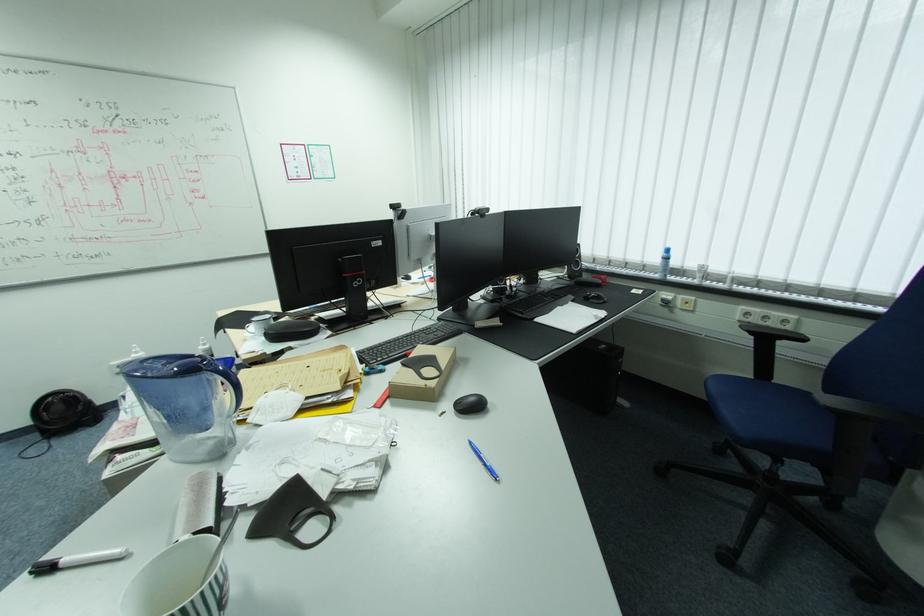
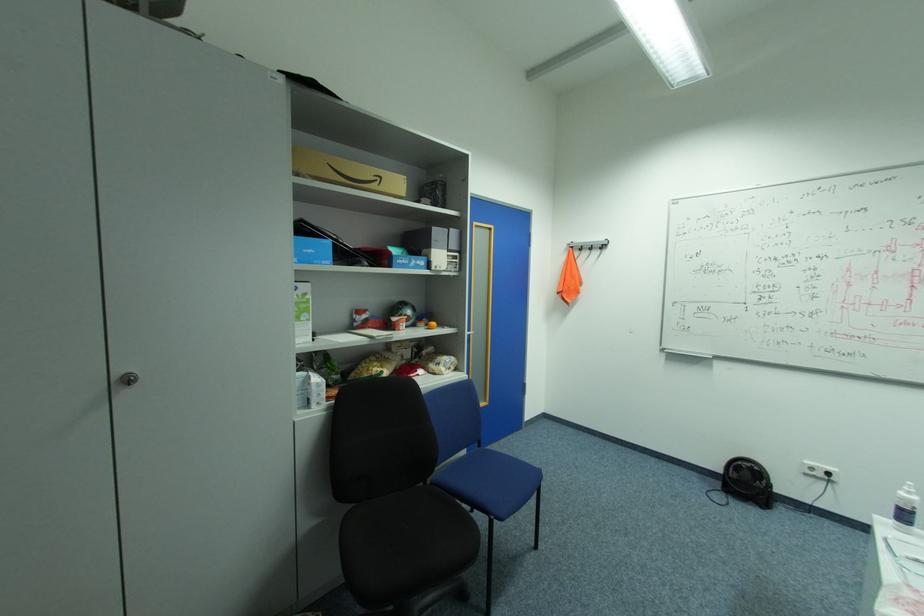
In the second image, find the point that corresponds to [143,353] in the first image.

(916, 493)